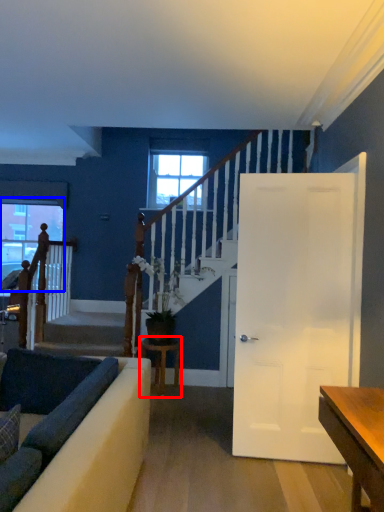
Question: Which point is further to the camera, table (highlighted by a red box) or window (highlighted by a blue box)?

Choices:
 (A) table
 (B) window

Answer: (B)